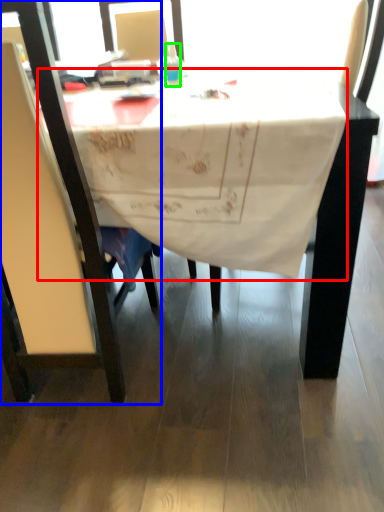
Question: Which is nearer to the tablecloth (highlighted by a red box)? chair (highlighted by a blue box) or bottle (highlighted by a green box).

Choices:
 (A) chair
 (B) bottle

Answer: (A)